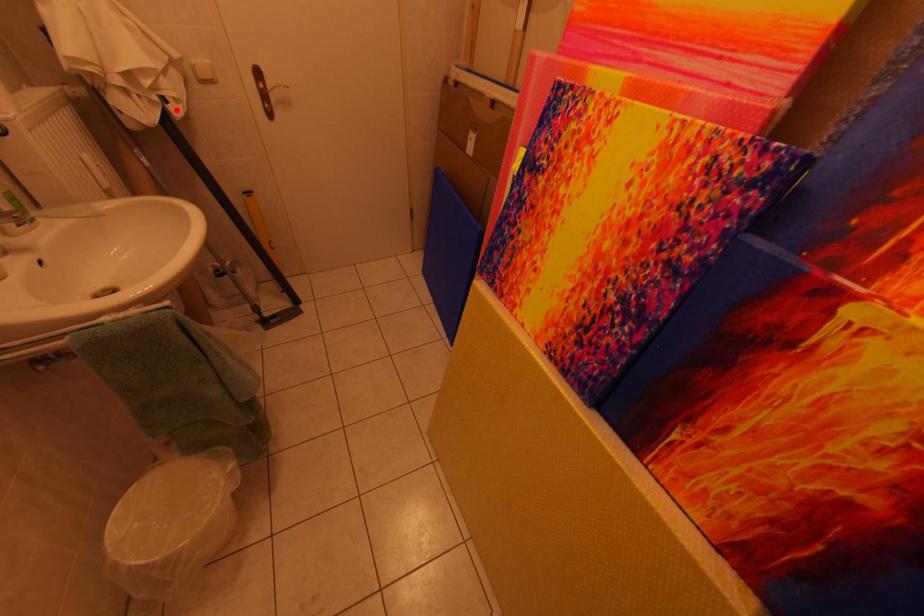
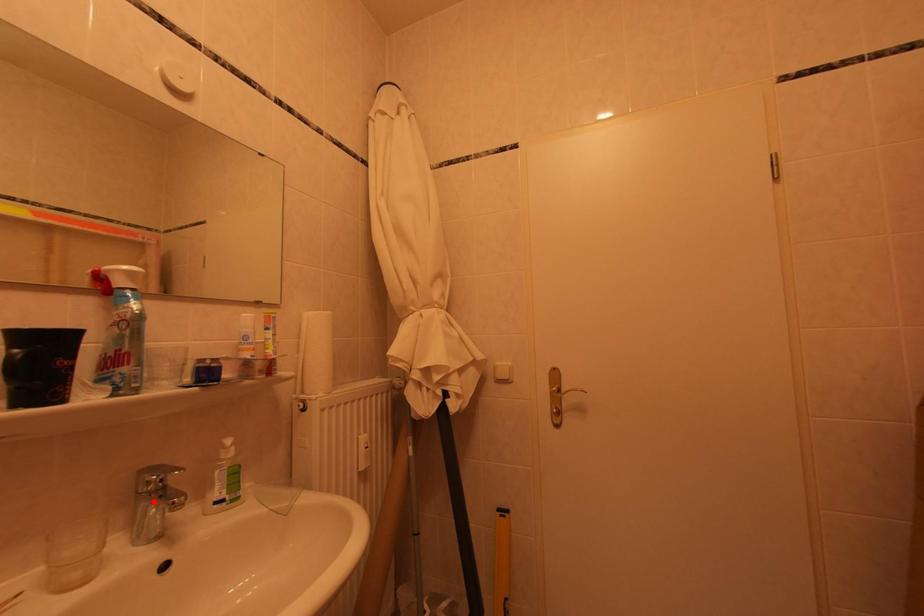
I am providing you with two images of the same scene from different viewpoints. A red point is marked on the first image and another point is marked on the second image. Is the red point in image1 aligned with the point shown in image2?

No